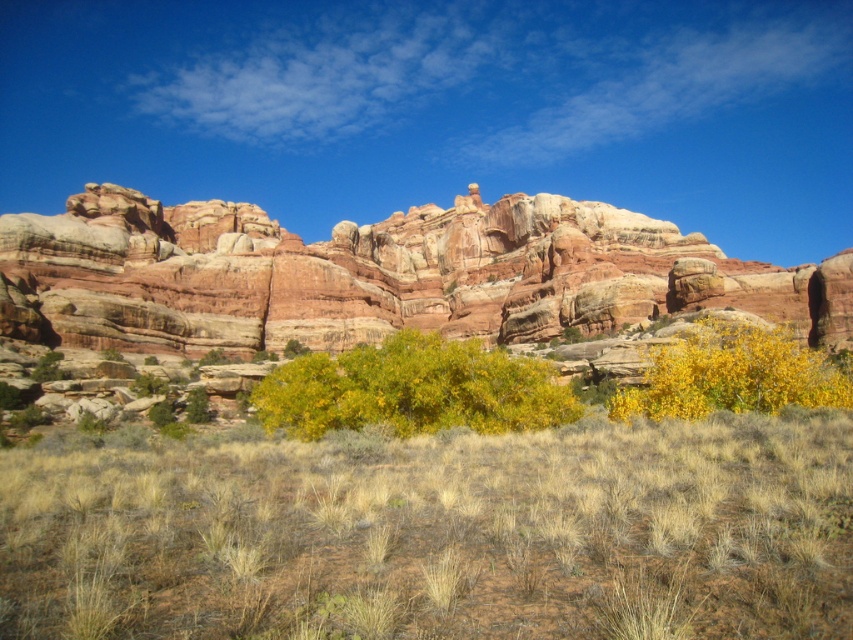
Question: In this image, where is rustic rock formation at center located relative to yellow-green leafy bush at center?

Choices:
 (A) above
 (B) below

Answer: (A)

Question: Based on their relative distances, which object is nearer to the rustic rock formation at center?

Choices:
 (A) yellow-green leafy bush at center
 (B) yellow leafy bush at lower right

Answer: (A)

Question: Which object is farther from the camera taking this photo?

Choices:
 (A) yellow-green leafy bush at center
 (B) dry grass at center

Answer: (A)

Question: Where is rustic rock formation at center located in relation to yellow-green leafy bush at center in the image?

Choices:
 (A) right
 (B) left

Answer: (B)

Question: Does dry grass at center appear under rustic rock formation at center?

Choices:
 (A) no
 (B) yes

Answer: (B)

Question: Which object appears closest to the camera in this image?

Choices:
 (A) yellow-green leafy bush at center
 (B) rustic rock formation at center
 (C) yellow leafy bush at lower right

Answer: (C)